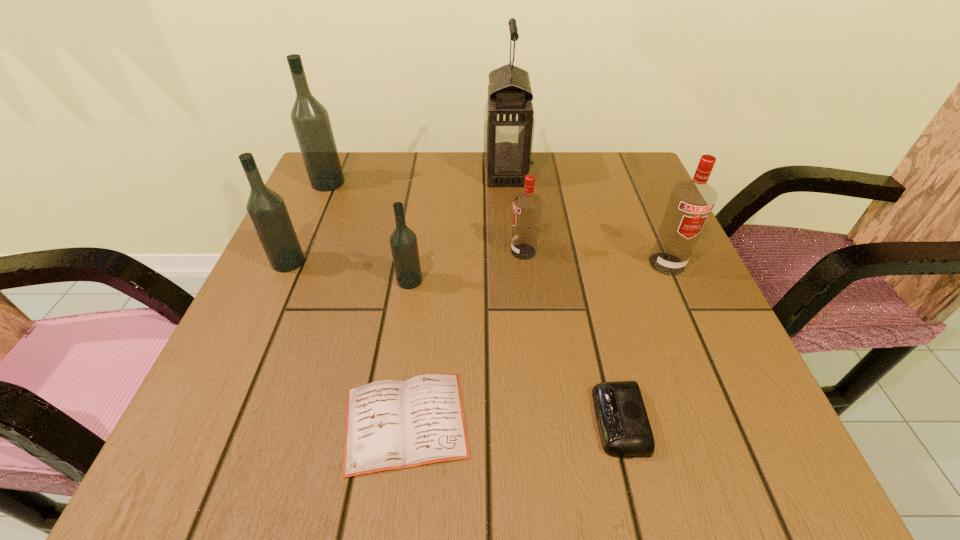
Image resolution: width=960 pixels, height=540 pixels. I want to click on free location at the near right corner of the desktop, so click(x=756, y=437).

Where is `unoccupied area between the alarm clock and the smallest black vodka`? The height and width of the screenshot is (540, 960). unoccupied area between the alarm clock and the smallest black vodka is located at coordinates (515, 350).

You are a GUI agent. You are given a task and a screenshot of the screen. Output one action in this format:
    pyautogui.click(x=<x>, y=<y>)
    Task: Click on the vacant region between the right red vodka and the left red vodka
    
    Given the screenshot: What is the action you would take?
    pyautogui.click(x=595, y=258)

At what (x,y) coordinates should I click in order to perform the action: click on free space between the diary and the lantern. Please return your answer as a coordinate pair (x, y). The width and height of the screenshot is (960, 540). Looking at the image, I should click on (456, 297).

The width and height of the screenshot is (960, 540). Find the location of `vacant area that lies between the shortest object and the gray lantern`. vacant area that lies between the shortest object and the gray lantern is located at coordinates (456, 297).

Find the location of a particular element. Image resolution: width=960 pixels, height=540 pixels. free space between the lantern and the white diary is located at coordinates (456, 297).

Locate an element on the screen. vacant area between the farthest black vodka and the smallest black vodka is located at coordinates (369, 232).

Image resolution: width=960 pixels, height=540 pixels. Find the location of `empty location between the diary and the rightmost black vodka`. empty location between the diary and the rightmost black vodka is located at coordinates (408, 351).

The image size is (960, 540). I want to click on vacant space that's between the third vodka from left to right and the lantern, so click(x=458, y=227).

Locate an element on the screen. Image resolution: width=960 pixels, height=540 pixels. free space between the right red vodka and the lantern is located at coordinates (587, 218).